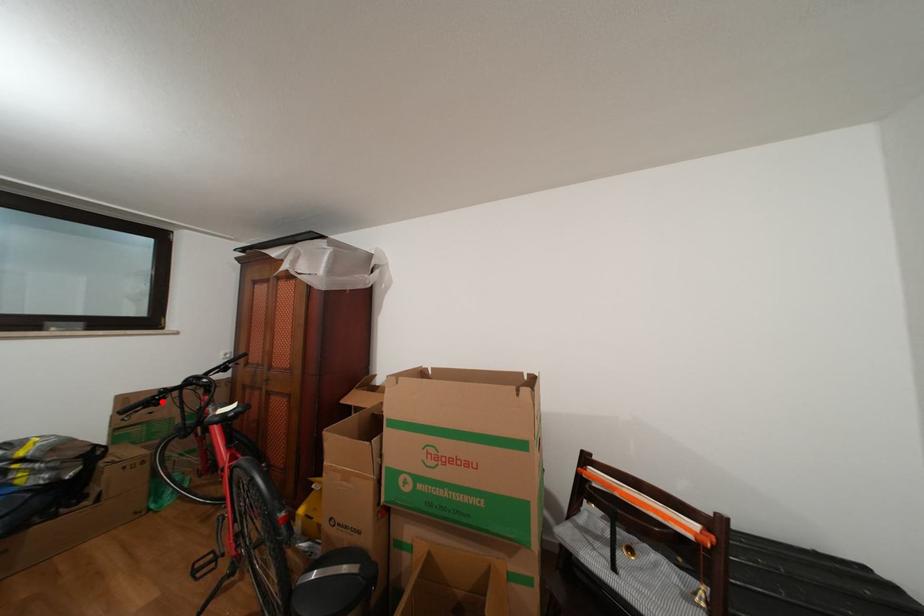
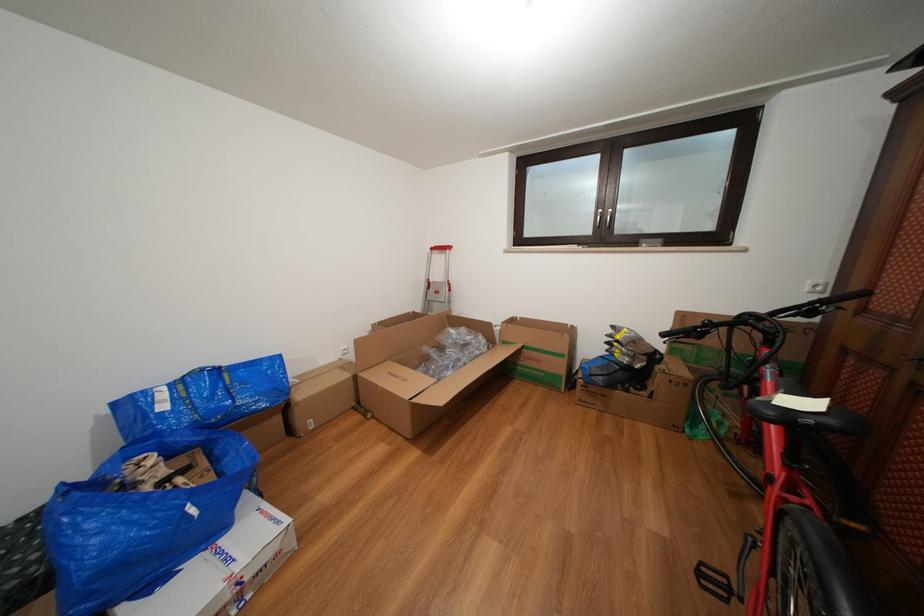
Question: I am providing you with two images of the same scene from different viewpoints. A red point is marked on the first image. Can you still see the location of the red point in image 2?

Choices:
 (A) Yes
 (B) No

Answer: (A)